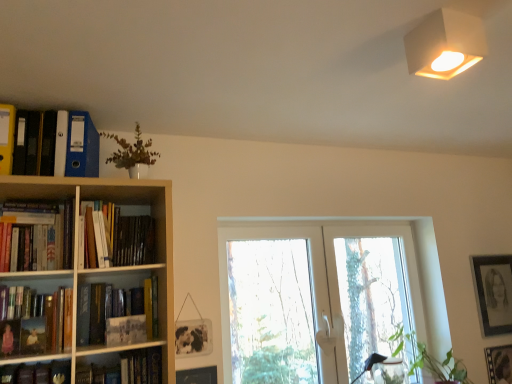
Question: From a real-world perspective, relative to transparent glass door at center, is green leafy plant at lower right, the 1th plant in the bottom-to-top sequence, vertically above or below?

Choices:
 (A) below
 (B) above

Answer: (A)

Question: Is green leafy plant at lower right, placed as the 2th plant when sorted from left to right, inside or outside of transparent glass door at center?

Choices:
 (A) outside
 (B) inside

Answer: (B)

Question: Which object is the farthest from the black matte picture frame at upper right, the third picture frame positioned from the front?

Choices:
 (A) white matte lampshade at upper right
 (B) hardcover book at center-left, positioned as the second book in bottom-to-top order
 (C) transparent glass door at center
 (D) matte paper paperback at left
 (E) green leafy plant at lower right, the 1th plant from the right

Answer: (D)

Question: Considering the real-world distances, which object is farthest from the green leafy plant at lower right, positioned as the 1th plant in back-to-front order?

Choices:
 (A) black matte picture frame at upper right, which is the first picture frame from top to bottom
 (B) white matte lampshade at upper right
 (C) hardcover book at lower left, the first book from the bottom
 (D) wooden picture frame at lower center, acting as the 3th picture frame starting from the right
 (E) matte paper paperback at left

Answer: (B)